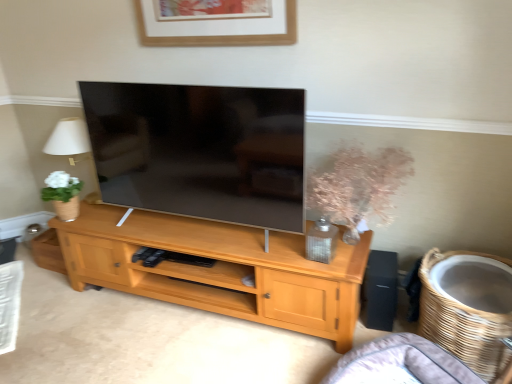
The width and height of the screenshot is (512, 384). In order to click on empty space that is ontop of light wood cabinet at center (from a real-world perspective) in this screenshot , I will do `click(161, 334)`.